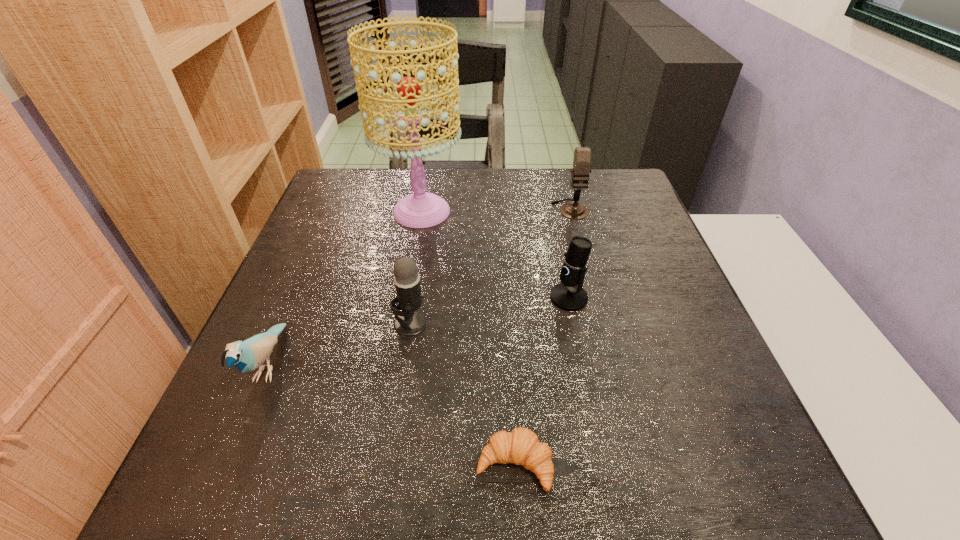
The image size is (960, 540). I want to click on the closest microphone to the bird, so click(409, 322).

The image size is (960, 540). I want to click on free space that satisfies the following two spatial constraints: 1. on the front side of the crescent roll; 2. on the left side of the tallest object, so click(x=379, y=464).